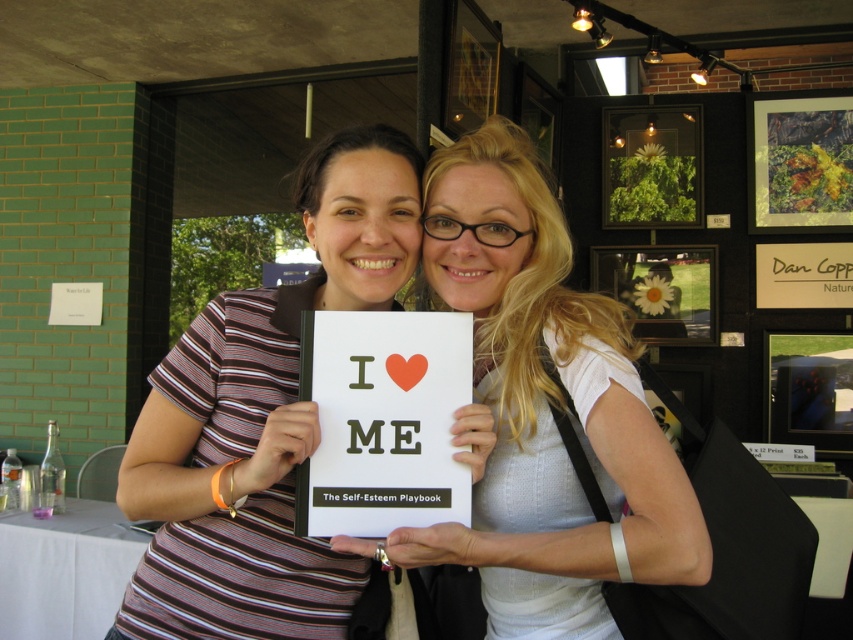
Does white matte book at center lie in front of white paper book at center?

That is True.

Image resolution: width=853 pixels, height=640 pixels. What are the coordinates of `white matte book at center` in the screenshot? It's located at (544, 410).

This screenshot has width=853, height=640. In order to click on white matte book at center in this screenshot , I will do `click(544, 410)`.

Is white matte book at center positioned before white paper at center?

Yes, white matte book at center is closer to the viewer.

Does white matte book at center have a lesser height compared to white paper at center?

No, white matte book at center is not shorter than white paper at center.

Which is in front, point (612, 488) or point (329, 524)?

Point (329, 524) is more forward.

Where is `white matte book at center`? Image resolution: width=853 pixels, height=640 pixels. white matte book at center is located at coordinates (544, 410).

What do you see at coordinates (262, 419) in the screenshot? The width and height of the screenshot is (853, 640). I see `white paper book at center` at bounding box center [262, 419].

Is point (219, 426) in front of point (437, 483)?

No, (219, 426) is behind (437, 483).

What are the coordinates of `white paper book at center` in the screenshot? It's located at (262, 419).